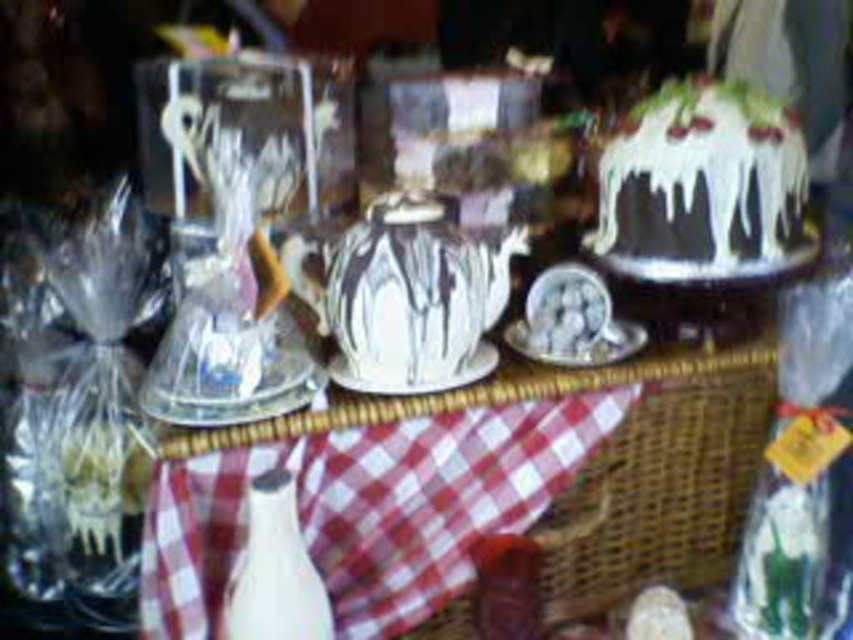
You are arranging items in the basket and want to place the white glossy bottle at center and the matte white plate at center in a specific order. According to the image, which item is positioned to the left of the other?

The white glossy bottle at center is to the left of the matte white plate at center.

You are standing in front of the decorative items display and want to pick up an item from the basket. Which of the two points, point (322,538) or point (701,99), is closer to you?

Point (322,538) is closer to the viewer than point (701,99), so you should reach for that one first.